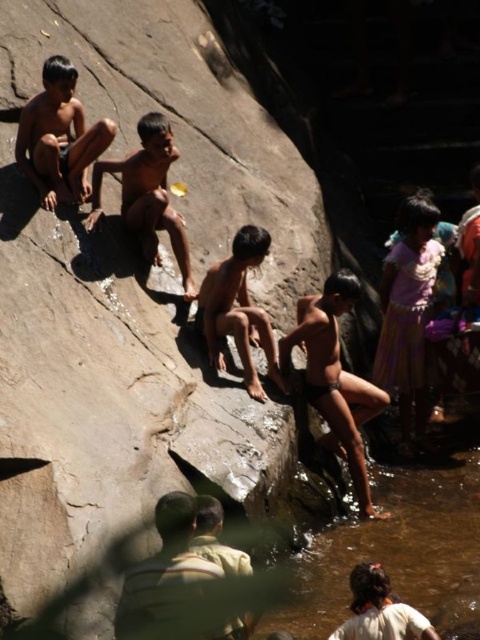
Question: Which of these objects is positioned farthest from the matte skin child at center?

Choices:
 (A) brown rough rock at upper left
 (B) light brown skin boy at left
 (C) pink fabric skirt at lower right
 (D) light brown skin boy at center

Answer: (B)

Question: Where is brown rough rock at upper left located in relation to light brown skin boy at center in the image?

Choices:
 (A) below
 (B) above

Answer: (A)

Question: Which object appears farthest from the camera in this image?

Choices:
 (A) pink fabric skirt at lower right
 (B) brown rough rock at upper left
 (C) matte skin child at center

Answer: (A)

Question: Does matte skin child at center have a smaller size compared to brown skin boy at center?

Choices:
 (A) yes
 (B) no

Answer: (A)

Question: Among these points, which one is farthest from the camera?

Choices:
 (A) (167, 140)
 (B) (307, 381)
 (C) (323, 262)
 (D) (249, 374)

Answer: (C)

Question: Can you confirm if matte skin child at center is thinner than light brown skin boy at left?

Choices:
 (A) no
 (B) yes

Answer: (B)